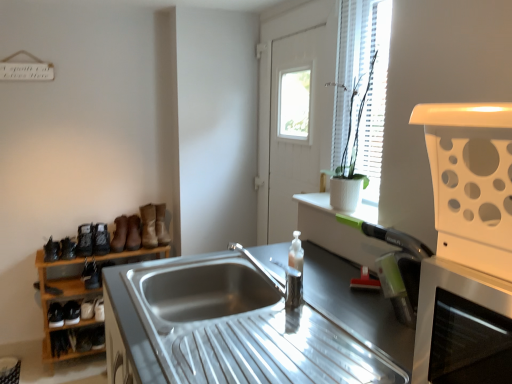
Measure the distance between leather boot at left, marked as the 6th boot in a left-to-right arrangement, and camera.

leather boot at left, marked as the 6th boot in a left-to-right arrangement, and camera are 8.47 feet apart from each other.

How much space does leather boot at left, marked as the second boot in a right-to-left arrangement, occupy horizontally?

The width of leather boot at left, marked as the second boot in a right-to-left arrangement, is 10.21 inches.

Measure the distance between point (124, 217) and camera.

Point (124, 217) and camera are 8.65 feet apart from each other.

Describe the element at coordinates (119, 234) in the screenshot. This screenshot has height=384, width=512. I see `brown suede boot at left, the fourth boot viewed from the left` at that location.

What do you see at coordinates (91, 275) in the screenshot? I see `brown suede boot at lower left, the sixth boot viewed from the right` at bounding box center [91, 275].

Measure the distance between point (278,83) and camera.

A distance of 8.64 feet exists between point (278,83) and camera.

Find the location of a particular element. leather boot at left, marked as the second boot in a right-to-left arrangement is located at coordinates (149, 226).

How many degrees apart are the facing directions of matte black shoe at left, placed as the second shoe when sorted from top to bottom, and leather boot at left, which is the first boot in right-to-left order?

The angle between the facing direction of matte black shoe at left, placed as the second shoe when sorted from top to bottom, and the facing direction of leather boot at left, which is the first boot in right-to-left order, is 12.6 degrees.

Looking at this image, is matte black shoe at left, placed as the second shoe when sorted from top to bottom, in front of or behind leather boot at left, which appears as the 7th boot when viewed from the left, in the image?

In the image, matte black shoe at left, placed as the second shoe when sorted from top to bottom, appears in front of leather boot at left, which appears as the 7th boot when viewed from the left.

Which is more to the left, matte black shoe at left, placed as the second shoe when sorted from top to bottom, or leather boot at left, which is the first boot in right-to-left order?

Positioned to the left is matte black shoe at left, placed as the second shoe when sorted from top to bottom.

Is matte black shoe at left, marked as the fourth shoe in a bottom-to-top arrangement, placed right next to leather boot at left, which appears as the 7th boot when viewed from the left?

No.

How distant is translucent plastic soap dispenser at center from leather shoe at lower left, the 5th shoe viewed from the top?

1.80 meters.

Can you confirm if translucent plastic soap dispenser at center is thinner than leather shoe at lower left, the 5th shoe viewed from the top?

Correct, the width of translucent plastic soap dispenser at center is less than that of leather shoe at lower left, the 5th shoe viewed from the top.

Can you confirm if translucent plastic soap dispenser at center is smaller than leather shoe at lower left, the 5th shoe viewed from the top?

Incorrect, translucent plastic soap dispenser at center is not smaller in size than leather shoe at lower left, the 5th shoe viewed from the top.

Considering the positions of points (167, 236) and (92, 226), is point (167, 236) closer to camera compared to point (92, 226)?

No.

Considering the sizes of objects leather boot at left, which is the first boot in right-to-left order, and leather boot at left, the 7th boot when ordered from right to left, in the image provided, who is shorter, leather boot at left, which is the first boot in right-to-left order, or leather boot at left, the 7th boot when ordered from right to left,?

Standing shorter between the two is leather boot at left, the 7th boot when ordered from right to left.

From the image's perspective, is leather boot at left, which appears as the 7th boot when viewed from the left, located above or below leather boot at left, the 7th boot when ordered from right to left?

Clearly, from the image's perspective, leather boot at left, which appears as the 7th boot when viewed from the left, is above leather boot at left, the 7th boot when ordered from right to left.

From a real-world perspective, does brown suede boot at lower left, which is the 3th boot from right to left, stand above brown suede boot at left, marked as the 4th boot in a right-to-left arrangement?

No.

Can you confirm if brown suede boot at lower left, the fifth boot in the left-to-right sequence, is bigger than brown suede boot at left, marked as the 4th boot in a right-to-left arrangement?

No.

Which is behind, point (128, 227) or point (111, 242)?

The point (128, 227) is more distant.

From the image's perspective, which boot is the 1st one above the brown suede boot at left, marked as the 4th boot in a right-to-left arrangement? Please provide its 2D coordinates.

[(133, 233)]

Identify the location of vent on the right of black leather shoe at lower left, which ranks as the third shoe in bottom-to-top order. The width and height of the screenshot is (512, 384). (471, 182).

Considering the sizes of objects black leather shoe at lower left, which is counted as the 3th shoe, starting from the top, and white plastic vent at right in the image provided, who is bigger, black leather shoe at lower left, which is counted as the 3th shoe, starting from the top, or white plastic vent at right?

white plastic vent at right.

Considering the relative positions of black leather shoe at lower left, which is counted as the 3th shoe, starting from the top, and white plastic vent at right in the image provided, is black leather shoe at lower left, which is counted as the 3th shoe, starting from the top, to the left of white plastic vent at right from the viewer's perspective?

Correct, you'll find black leather shoe at lower left, which is counted as the 3th shoe, starting from the top, to the left of white plastic vent at right.

Between leather boot at left, the third boot when ordered from left to right, and leather boot at left, marked as the second boot in a right-to-left arrangement, which one is positioned in front?

leather boot at left, the third boot when ordered from left to right, is closer to the camera.

Is leather boot at left, placed as the fifth boot when sorted from right to left, turned away from leather boot at left, marked as the 6th boot in a left-to-right arrangement?

leather boot at left, placed as the fifth boot when sorted from right to left, is not turned away from leather boot at left, marked as the 6th boot in a left-to-right arrangement.

Which object is thinner, leather boot at left, the third boot when ordered from left to right, or leather boot at left, marked as the second boot in a right-to-left arrangement?

With smaller width is leather boot at left, the third boot when ordered from left to right.

From the image's perspective, between leather boot at left, the third boot when ordered from left to right, and leather boot at left, marked as the 6th boot in a left-to-right arrangement, which one is located above?

leather boot at left, marked as the 6th boot in a left-to-right arrangement, is shown above in the image.

From a real-world perspective, who is located higher, black leather shoe at lower left, which ranks as the third shoe in bottom-to-top order, or leather boot at left, marked as the second boot in a right-to-left arrangement?

leather boot at left, marked as the second boot in a right-to-left arrangement, from a real-world perspective.

Is black leather shoe at lower left, which is counted as the 3th shoe, starting from the top, thinner than leather boot at left, marked as the 6th boot in a left-to-right arrangement?

Correct, the width of black leather shoe at lower left, which is counted as the 3th shoe, starting from the top, is less than that of leather boot at left, marked as the 6th boot in a left-to-right arrangement.

From a real-world perspective, count 3rd shoes downward from the leather boot at left, marked as the second boot in a right-to-left arrangement, and point to it. Please provide its 2D coordinates.

[(71, 312)]

From a real-world perspective, which boot is the 5th one above the matte black shoe at left, placed as the second shoe when sorted from top to bottom? Please provide its 2D coordinates.

[(161, 225)]

Starting from the translucent plastic soap dispenser at center, which shoe is the 5th one behind? Please provide its 2D coordinates.

[(72, 339)]

From the image, which object appears to be farther from stainless steel oven at right, leather boot at left, marked as the second boot in a right-to-left arrangement, or matte black shoe at left, marked as the fourth shoe in a bottom-to-top arrangement?

matte black shoe at left, marked as the fourth shoe in a bottom-to-top arrangement, is positioned further to the anchor stainless steel oven at right.

Which object lies nearer to the anchor point brown suede boot at lower left, positioned as the second boot in left-to-right order, leather boot at left, the third boot when ordered from left to right, or white wooden door at center?

leather boot at left, the third boot when ordered from left to right.

Considering their positions, is wooden shoe rack at left positioned further to matte black shoe at left, placed as the second shoe when sorted from top to bottom, than leather boot at left, the third boot when ordered from left to right?

wooden shoe rack at left.

Looking at the image, which one is located closer to white plastic vent at right, leather boot at left, the 7th boot when ordered from right to left, or stainless steel oven at right?

stainless steel oven at right lies closer to white plastic vent at right than the other object.

In the scene shown: Considering their positions, is leather shoe at lower left, which is counted as the first shoe, starting from the bottom, positioned closer to brown suede boot at lower left, positioned as the second boot in left-to-right order, than white wooden door at center?

leather shoe at lower left, which is counted as the first shoe, starting from the bottom.

When comparing their distances from leather shoe at lower left, the 5th shoe viewed from the top, does brown suede boot at lower left, which is the 3th boot from right to left, or matte black shoe at left, the first shoe viewed from the top, seem further?

Based on the image, brown suede boot at lower left, which is the 3th boot from right to left, appears to be further to leather shoe at lower left, the 5th shoe viewed from the top.

Based on their spatial positions, is black leather shoe at lower left, which ranks as the third shoe in bottom-to-top order, or leather boot at left, marked as the second boot in a right-to-left arrangement, closer to leather boot at left, placed as the fifth boot when sorted from right to left?

leather boot at left, marked as the second boot in a right-to-left arrangement, is positioned closer to the anchor leather boot at left, placed as the fifth boot when sorted from right to left.

Estimate the real-world distances between objects in this image. Which object is closer to leather boot at left, the third boot when ordered from left to right, black leather shoe at lower left, positioned as the second shoe in bottom-to-top order, or leather boot at left, the 7th boot when ordered from right to left?

leather boot at left, the 7th boot when ordered from right to left, is closer to leather boot at left, the third boot when ordered from left to right.

Locate an element on the screen. Image resolution: width=512 pixels, height=384 pixels. bottle between stainless steel sink at center and leather shoe at lower left, which is counted as the first shoe, starting from the bottom, from front to back is located at coordinates (294, 273).

Image resolution: width=512 pixels, height=384 pixels. Identify the location of shelf between leather boot at left, which is the first boot in right-to-left order, and black leather shoe at lower left, which is counted as the 3th shoe, starting from the top, in the vertical direction. pyautogui.click(x=59, y=299).

This screenshot has height=384, width=512. Find the location of `bottle located between leather shoe at lower left, which is counted as the first shoe, starting from the bottom, and white wooden door at center in the left-right direction`. bottle located between leather shoe at lower left, which is counted as the first shoe, starting from the bottom, and white wooden door at center in the left-right direction is located at coordinates (294, 273).

Locate an element on the screen. The width and height of the screenshot is (512, 384). bottle between stainless steel oven at right and leather boot at left, marked as the second boot in a right-to-left arrangement, in the front-back direction is located at coordinates (294, 273).